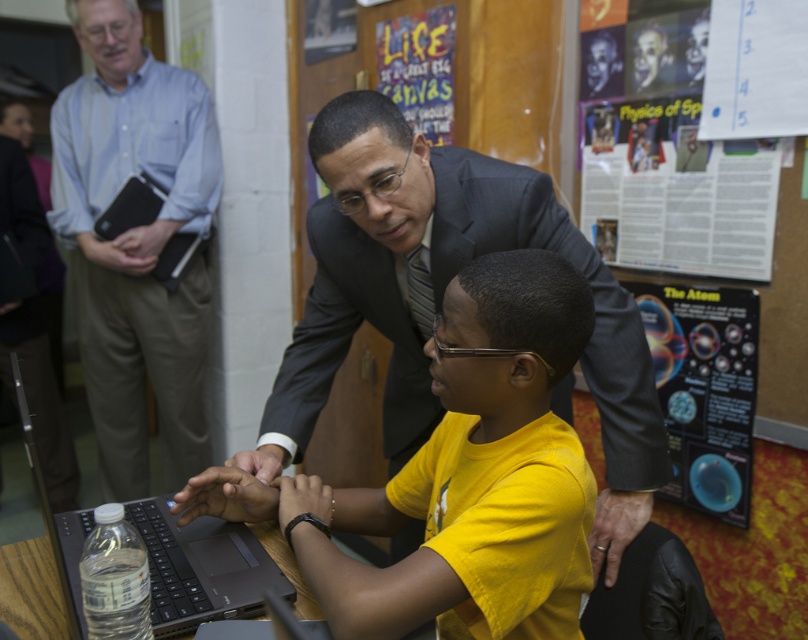
You are a photographer standing at the camera position. You want to take a photo of the matte black hands at center. Can you clearly capture the hands without any obstruction?

The matte black hands at center and camera are 3.38 feet apart, so yes, the distance is sufficient to capture the hands clearly without obstruction.

You are a teacher observing a classroom scene. You notice the matte black hands at center and the dark gray leather hand at lower center. Which object is positioned to the right side of the other?

The dark gray leather hand at lower center is to the right of the matte black hands at center.